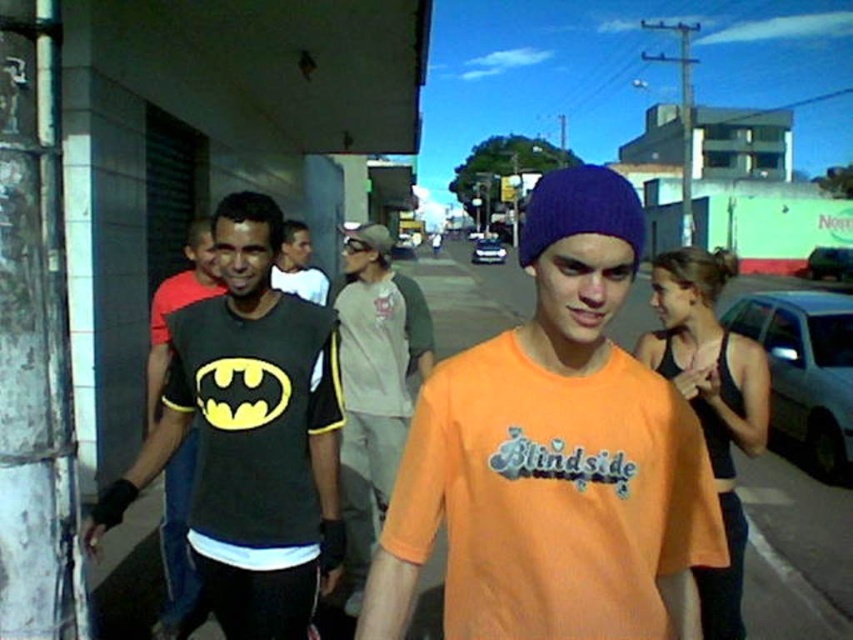
Between black matte t-shirt at left and matte black t-shirt at center, which one is positioned lower?

Positioned lower is black matte t-shirt at left.

Which of these two, black matte t-shirt at left or matte black t-shirt at center, stands shorter?

matte black t-shirt at center is shorter.

Does point (283, 378) lie in front of point (321, 355)?

Yes, point (283, 378) is closer to viewer.

In order to click on black matte t-shirt at left in this screenshot , I will do `click(250, 436)`.

Is orange cotton t-shirt at center to the left of gray cotton sweatshirt at center from the viewer's perspective?

In fact, orange cotton t-shirt at center is to the right of gray cotton sweatshirt at center.

Is orange cotton t-shirt at center closer to the viewer compared to gray cotton sweatshirt at center?

Yes, orange cotton t-shirt at center is in front of gray cotton sweatshirt at center.

Which is behind, point (569, 173) or point (387, 422)?

The point (387, 422) is behind.

At what (x,y) coordinates should I click in order to perform the action: click on orange cotton t-shirt at center. Please return your answer as a coordinate pair (x, y). Image resolution: width=853 pixels, height=640 pixels. Looking at the image, I should click on (554, 458).

From the picture: Between gray cotton sweatshirt at center and matte black t-shirt at center, which one appears on the right side from the viewer's perspective?

gray cotton sweatshirt at center

How much distance is there between gray cotton sweatshirt at center and matte black t-shirt at center?

gray cotton sweatshirt at center and matte black t-shirt at center are 3.73 feet apart from each other.

You are a GUI agent. You are given a task and a screenshot of the screen. Output one action in this format:
    pyautogui.click(x=<x>, y=<y>)
    Task: Click on the gray cotton sweatshirt at center
    
    Given the screenshot: What is the action you would take?
    pyautogui.click(x=374, y=385)

Find the location of a particular element. The image size is (853, 640). gray cotton sweatshirt at center is located at coordinates (374, 385).